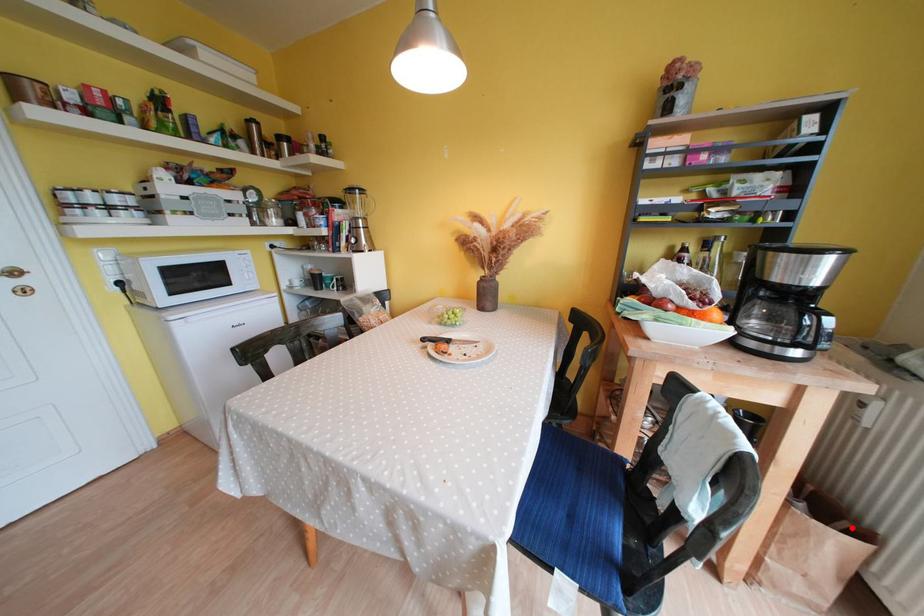
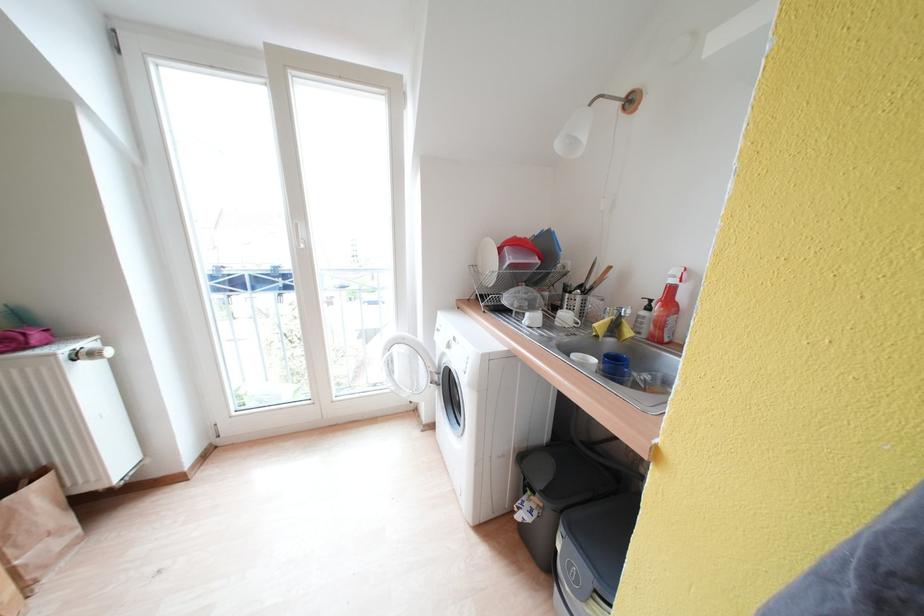
Question: I am providing you with two images of the same scene from different viewpoints. In image1, a red point is highlighted. Considering the same 3D point in image2, which of the following is correct?

Choices:
 (A) It is closer
 (B) It is farther

Answer: (B)